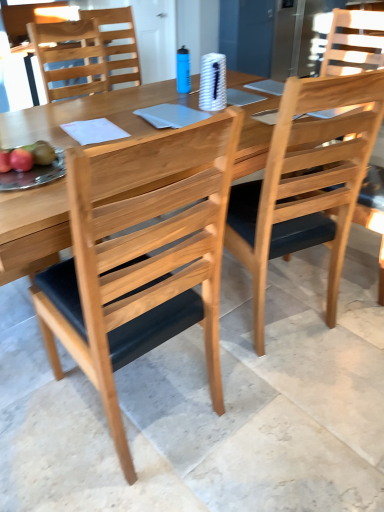
Question: Which direction should I rotate to look at natural wood chair at center, placed as the third chair when sorted from back to front?

Choices:
 (A) left
 (B) right

Answer: (A)

Question: Would you say natural wood table at center is a long distance from shiny red apple at left, which appears as the 2th fruit when viewed from the back?

Choices:
 (A) no
 (B) yes

Answer: (A)

Question: Does natural wood table at center appear on the right side of shiny red apple at left, which appears as the 2th fruit when viewed from the back?

Choices:
 (A) no
 (B) yes

Answer: (B)

Question: Is natural wood table at center closer to the viewer compared to shiny red apple at left, arranged as the 1th fruit when viewed from the front?

Choices:
 (A) no
 (B) yes

Answer: (B)

Question: Considering the relative positions of natural wood table at center and shiny red apple at left, which appears as the 2th fruit when viewed from the back, in the image provided, is natural wood table at center behind shiny red apple at left, which appears as the 2th fruit when viewed from the back,?

Choices:
 (A) no
 (B) yes

Answer: (A)

Question: Does natural wood table at center have a larger size compared to shiny red apple at left, which appears as the 2th fruit when viewed from the back?

Choices:
 (A) no
 (B) yes

Answer: (B)

Question: Is natural wood table at center aimed at shiny red apple at left, which appears as the 2th fruit when viewed from the back?

Choices:
 (A) yes
 (B) no

Answer: (B)

Question: From a real-world perspective, is natural wood chair at upper left, which is the third chair in front-to-back order, over natural wood table at center?

Choices:
 (A) yes
 (B) no

Answer: (A)

Question: Considering the relative sizes of natural wood chair at upper left, which is the third chair in front-to-back order, and natural wood table at center in the image provided, is natural wood chair at upper left, which is the third chair in front-to-back order, bigger than natural wood table at center?

Choices:
 (A) yes
 (B) no

Answer: (B)

Question: Does natural wood chair at upper left, which is the third chair in front-to-back order, have a smaller size compared to natural wood table at center?

Choices:
 (A) no
 (B) yes

Answer: (B)

Question: Is natural wood chair at upper left, which is the third chair in front-to-back order, thinner than natural wood table at center?

Choices:
 (A) yes
 (B) no

Answer: (A)

Question: Does natural wood chair at upper left, acting as the 1th chair starting from the back, have a greater height compared to natural wood table at center?

Choices:
 (A) no
 (B) yes

Answer: (A)

Question: Does natural wood chair at upper left, acting as the 1th chair starting from the back, have a greater width compared to natural wood table at center?

Choices:
 (A) yes
 (B) no

Answer: (B)

Question: Can you confirm if natural wood chair at center, placed as the third chair when sorted from back to front, is bigger than natural wood table at center?

Choices:
 (A) no
 (B) yes

Answer: (A)